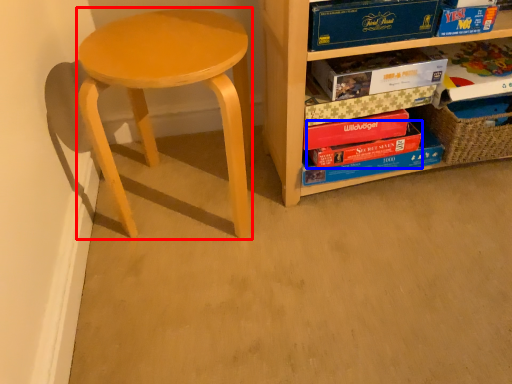
Question: Among these objects, which one is farthest to the camera, stool (highlighted by a red box) or paperback book (highlighted by a blue box)?

Choices:
 (A) stool
 (B) paperback book

Answer: (B)